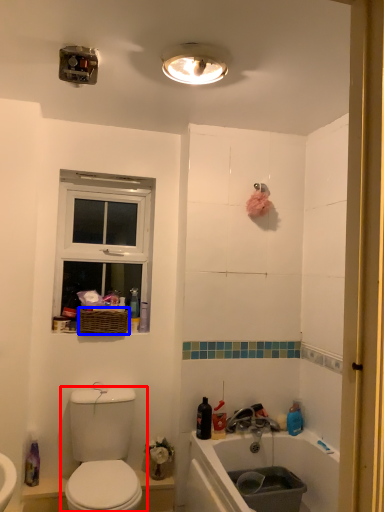
Question: Which object appears farthest to the camera in this image, toilet (highlighted by a red box) or basket (highlighted by a blue box)?

Choices:
 (A) toilet
 (B) basket

Answer: (B)